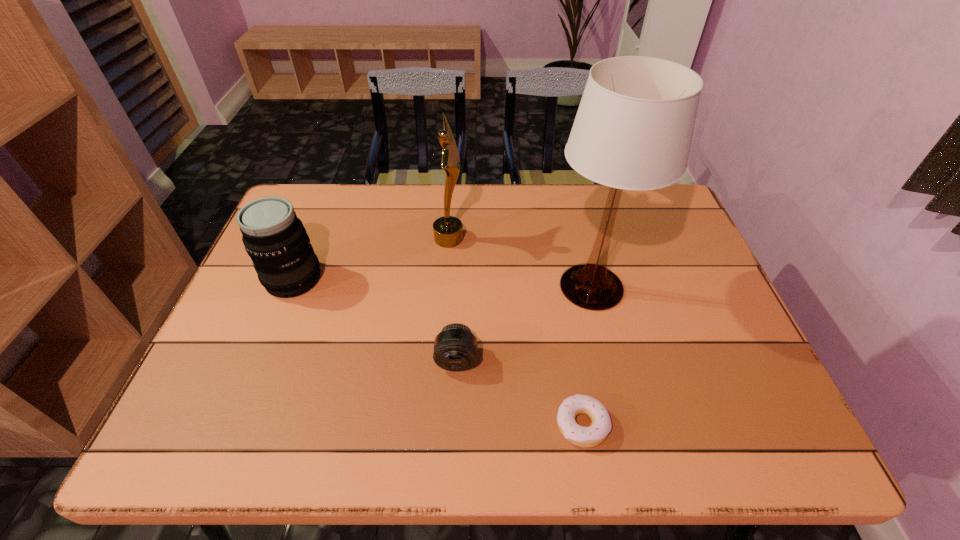
The image size is (960, 540). I want to click on table lamp, so click(633, 130).

What are the coordinates of `award` in the screenshot? It's located at (448, 230).

I want to click on the second tallest object, so click(448, 230).

This screenshot has width=960, height=540. Identify the location of the left telephoto lens. (274, 237).

This screenshot has width=960, height=540. I want to click on the farther telephoto lens, so click(x=274, y=237).

The width and height of the screenshot is (960, 540). In order to click on the second shortest object in this screenshot , I will do click(455, 348).

What are the coordinates of `the right telephoto lens` in the screenshot? It's located at (455, 348).

This screenshot has height=540, width=960. In order to click on doughnut in this screenshot , I will do `click(591, 436)`.

Locate an element on the screen. the shortest object is located at coordinates (591, 436).

This screenshot has height=540, width=960. Identify the location of free spot located 0.170m above the cylindrical shade of the table lamp. (614, 384).